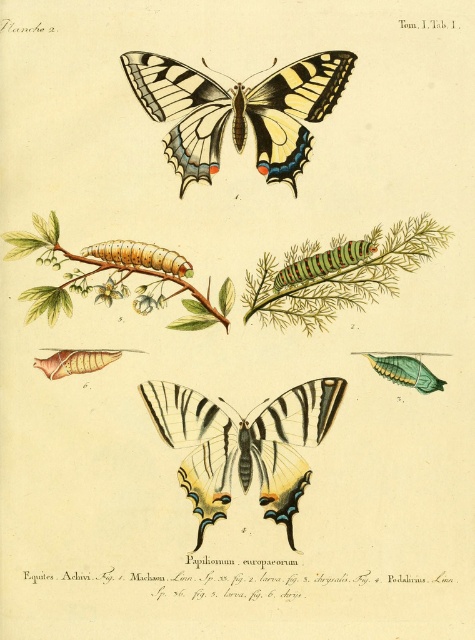
You are standing 1.5 meters away from the image. Is the point at coordinates point [200,113] closer to you or farther than the rest of the image?

The point at coordinates point [200,113] is 1.42 meters away from the viewer, which is slightly closer than your current position of 1.5 meters. Therefore, it is closer to you than the rest of the image.